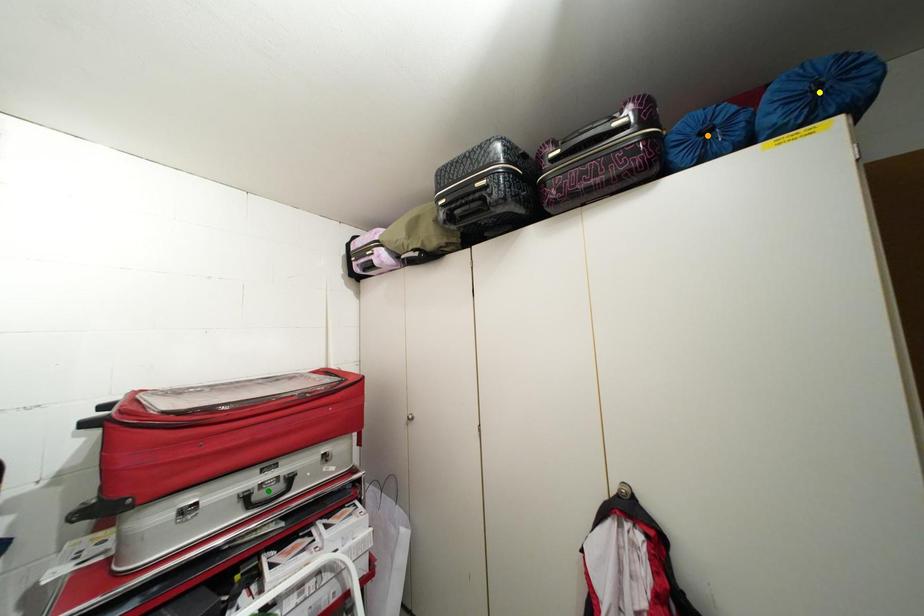
Order these from nearest to farthest:
1. green point
2. yellow point
3. orange point

green point → orange point → yellow point